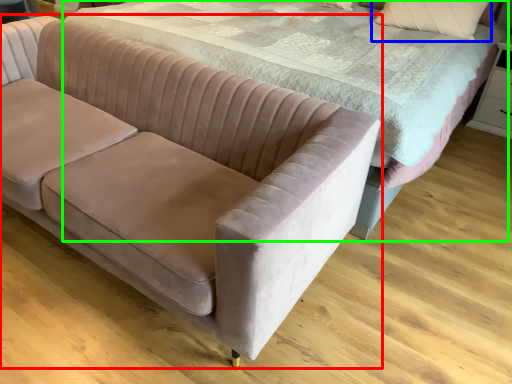
Question: Which is farther away from studio couch (highlighted by a red box)? pillow (highlighted by a blue box) or bed (highlighted by a green box)?

Choices:
 (A) pillow
 (B) bed

Answer: (A)